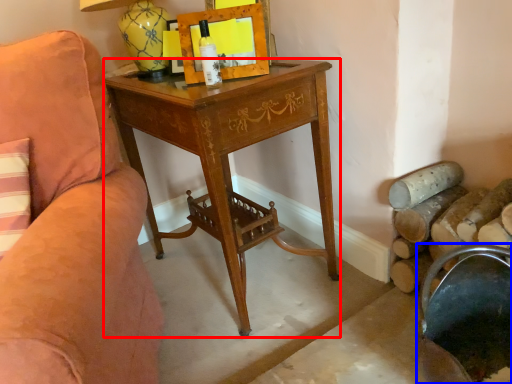
Question: Which object is further to the camera taking this photo, desk (highlighted by a red box) or rocking chair (highlighted by a blue box)?

Choices:
 (A) desk
 (B) rocking chair

Answer: (A)